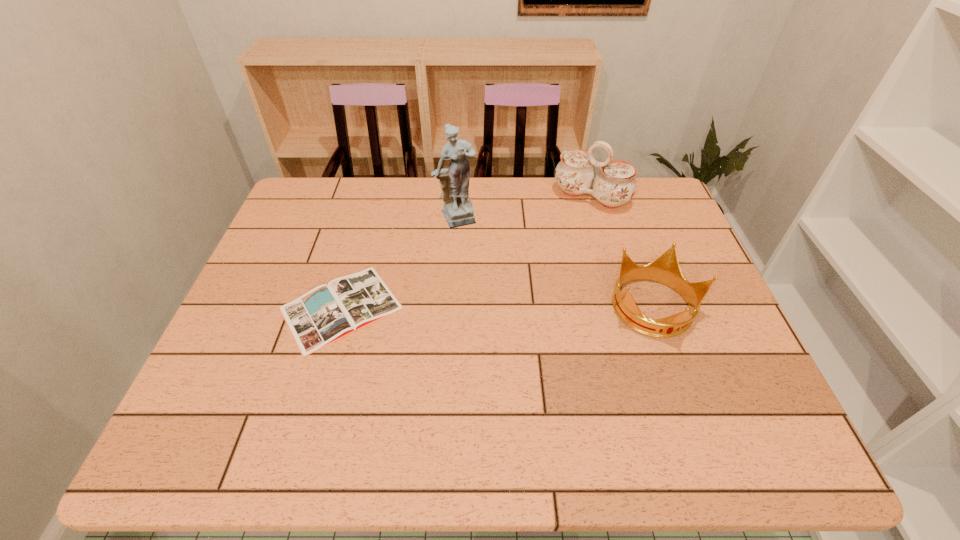
This screenshot has height=540, width=960. What are the coordinates of `book` in the screenshot? It's located at (327, 313).

I want to click on the leftmost object, so [x=327, y=313].

Find the location of a particular element. the second shortest object is located at coordinates (665, 269).

Where is `the second tallest object`? This screenshot has height=540, width=960. the second tallest object is located at coordinates (615, 184).

Find the location of a particular element. the second object from left to right is located at coordinates (454, 181).

I want to click on the tallest object, so click(x=454, y=181).

Locate an element on the screen. free location located on the back of the book is located at coordinates (364, 227).

Locate an element on the screen. The width and height of the screenshot is (960, 540). blank area located on the back of the crown is located at coordinates (616, 200).

This screenshot has height=540, width=960. I want to click on free spot located 0.210m by the handle of the second tallest object, so click(549, 253).

Find the location of a particular element. free space located by the handle of the second tallest object is located at coordinates pyautogui.click(x=561, y=237).